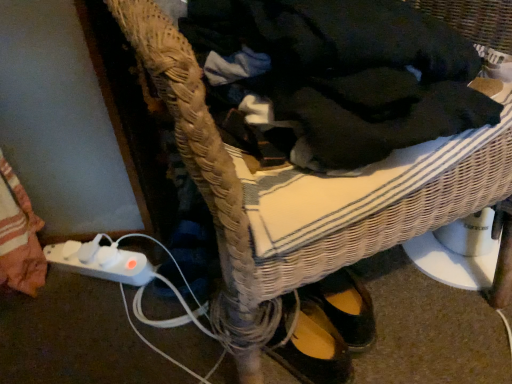
What do you see at coordinates (101, 262) in the screenshot? I see `white plastic plug at lower left` at bounding box center [101, 262].

I want to click on white plastic plug at lower left, so click(101, 262).

Measure the distance between white plastic plug at lower left and camera.

white plastic plug at lower left and camera are 35.06 inches apart from each other.

Find the location of a particular element. dark woven fabric at center is located at coordinates (338, 75).

This screenshot has width=512, height=384. Describe the element at coordinates (338, 75) in the screenshot. I see `dark woven fabric at center` at that location.

This screenshot has width=512, height=384. In order to click on white plastic plug at lower left in this screenshot , I will do `click(101, 262)`.

Which object is positioned more to the right, dark woven fabric at center or white plastic plug at lower left?

From the viewer's perspective, dark woven fabric at center appears more on the right side.

Is dark woven fabric at center in front of white plastic plug at lower left?

Yes, dark woven fabric at center is closer to the camera.

Considering the positions of point (348, 26) and point (92, 272), is point (348, 26) closer or farther from the camera than point (92, 272)?

Point (348, 26) is positioned closer to the camera compared to point (92, 272).

From the image's perspective, which object appears higher, dark woven fabric at center or white plastic plug at lower left?

dark woven fabric at center appears higher in the image.

From a real-world perspective, relative to white plastic plug at lower left, is dark woven fabric at center vertically above or below?

dark woven fabric at center is above white plastic plug at lower left.

Is dark woven fabric at center wider or thinner than white plastic plug at lower left?

In the image, dark woven fabric at center appears to be wider than white plastic plug at lower left.

In terms of height, does dark woven fabric at center look taller or shorter compared to white plastic plug at lower left?

dark woven fabric at center is taller than white plastic plug at lower left.

Which of these two, dark woven fabric at center or white plastic plug at lower left, is smaller?

white plastic plug at lower left is smaller.

Is dark woven fabric at center not inside white plastic plug at lower left?

That's correct, dark woven fabric at center is outside of white plastic plug at lower left.

Are dark woven fabric at center and white plastic plug at lower left far apart?

dark woven fabric at center is actually quite close to white plastic plug at lower left.

Is dark woven fabric at center oriented away from white plastic plug at lower left?

No.

Can you tell me how much dark woven fabric at center and white plastic plug at lower left differ in facing direction?

56.4 degrees.

The height and width of the screenshot is (384, 512). Find the location of `clothing positioned vertically above the white plastic plug at lower left (from a real-world perspective)`. clothing positioned vertically above the white plastic plug at lower left (from a real-world perspective) is located at coordinates (338, 75).

Considering the relative positions of white plastic plug at lower left and dark woven fabric at center in the image provided, is white plastic plug at lower left to the left or to the right of dark woven fabric at center?

In the image, white plastic plug at lower left appears on the left side of dark woven fabric at center.

In the image, is white plastic plug at lower left positioned in front of or behind dark woven fabric at center?

white plastic plug at lower left is positioned farther from the viewer than dark woven fabric at center.

Which is behind, point (67, 259) or point (349, 79)?

Positioned behind is point (67, 259).

From the image's perspective, does white plastic plug at lower left appear lower than dark woven fabric at center?

Yes, from the image's perspective, white plastic plug at lower left is beneath dark woven fabric at center.

Based on the photo, from a real-world perspective, is white plastic plug at lower left located beneath dark woven fabric at center?

Correct, in the physical world, white plastic plug at lower left is lower than dark woven fabric at center.

Between white plastic plug at lower left and dark woven fabric at center, which one has smaller width?

white plastic plug at lower left.

Can you confirm if white plastic plug at lower left is shorter than dark woven fabric at center?

Yes, white plastic plug at lower left is shorter than dark woven fabric at center.

Who is smaller, white plastic plug at lower left or dark woven fabric at center?

With smaller size is white plastic plug at lower left.

Is white plastic plug at lower left not inside dark woven fabric at center?

Yes.

Is white plastic plug at lower left not close to dark woven fabric at center?

No, white plastic plug at lower left is in close proximity to dark woven fabric at center.

Is white plastic plug at lower left oriented towards dark woven fabric at center?

No, white plastic plug at lower left is not facing towards dark woven fabric at center.

How different are the orientations of white plastic plug at lower left and dark woven fabric at center in degrees?

There is a 56.4-degree angle between the facing directions of white plastic plug at lower left and dark woven fabric at center.

This screenshot has height=384, width=512. In the image, there is a white plastic plug at lower left. In order to click on clothing above it (from the image's perspective) in this screenshot , I will do `click(338, 75)`.

You are a GUI agent. You are given a task and a screenshot of the screen. Output one action in this format:
    pyautogui.click(x=<x>, y=<y>)
    Task: Click on the clothing in front of the white plastic plug at lower left
    Image resolution: width=512 pixels, height=384 pixels.
    Given the screenshot: What is the action you would take?
    pyautogui.click(x=338, y=75)

The width and height of the screenshot is (512, 384). In order to click on plug below the dark woven fabric at center (from the image's perspective) in this screenshot , I will do pos(101,262).